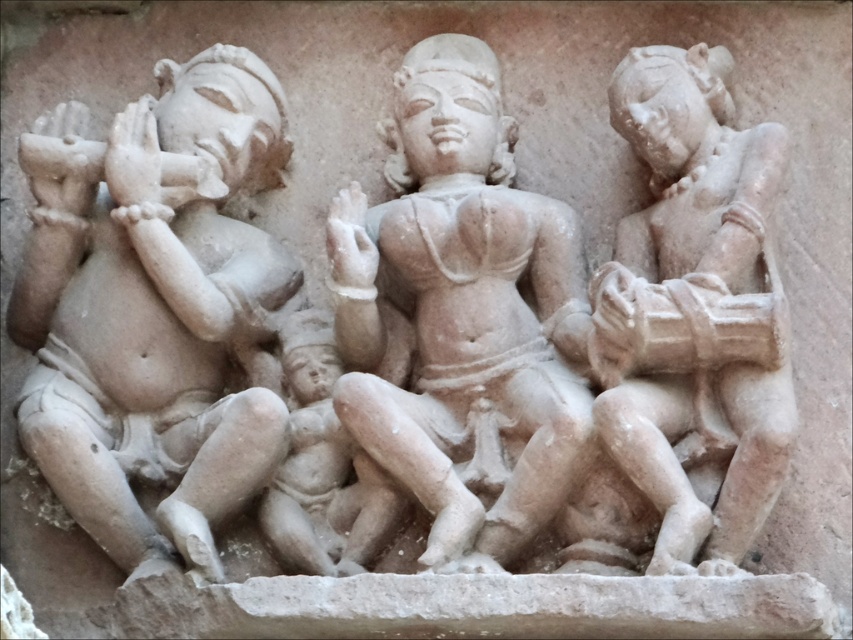
Question: Can you confirm if matte stone baby at left is smaller than smooth stone figure at right?

Choices:
 (A) yes
 (B) no

Answer: (B)

Question: Which object is the farthest from the matte stone baby at left?

Choices:
 (A) smooth stone figure at right
 (B) smooth beige statue at center

Answer: (A)

Question: Among these objects, which one is farthest from the camera?

Choices:
 (A) matte stone baby at left
 (B) smooth stone figure at right
 (C) smooth beige statue at center

Answer: (A)

Question: Estimate the real-world distances between objects in this image. Which object is closer to the smooth stone figure at right?

Choices:
 (A) smooth beige statue at center
 (B) matte stone baby at left

Answer: (A)

Question: Is smooth beige statue at center to the left of smooth stone figure at right from the viewer's perspective?

Choices:
 (A) yes
 (B) no

Answer: (A)

Question: Does matte stone baby at left have a smaller size compared to smooth beige statue at center?

Choices:
 (A) no
 (B) yes

Answer: (A)